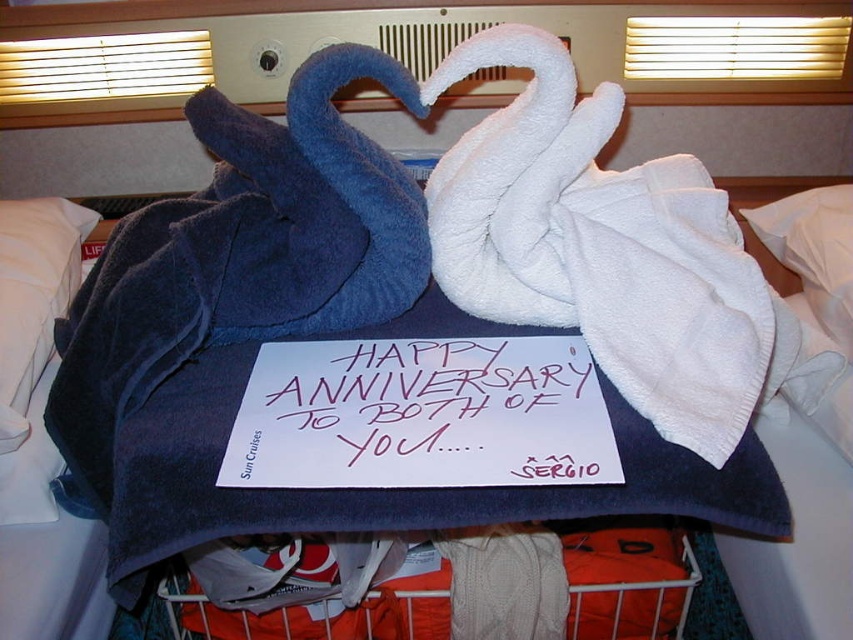
Does orange fabric basket at lower center have a larger size compared to white soft pillow at upper center?

Indeed, orange fabric basket at lower center has a larger size compared to white soft pillow at upper center.

Can you confirm if orange fabric basket at lower center is wider than white soft pillow at upper center?

Correct, the width of orange fabric basket at lower center exceeds that of white soft pillow at upper center.

Where is `orange fabric basket at lower center`? The width and height of the screenshot is (853, 640). orange fabric basket at lower center is located at coordinates (627, 580).

Is point (587, 445) closer to viewer compared to point (663, 541)?

That is True.

Locate an element on the screen. Image resolution: width=853 pixels, height=640 pixels. white paper at center is located at coordinates (425, 413).

The image size is (853, 640). Describe the element at coordinates (425, 413) in the screenshot. I see `white paper at center` at that location.

Is white paper at center above white soft pillow at upper center?

No, white paper at center is not above white soft pillow at upper center.

Is point (564, 362) positioned in front of point (793, 241)?

That is True.

Find the location of `white paper at center`. white paper at center is located at coordinates (425, 413).